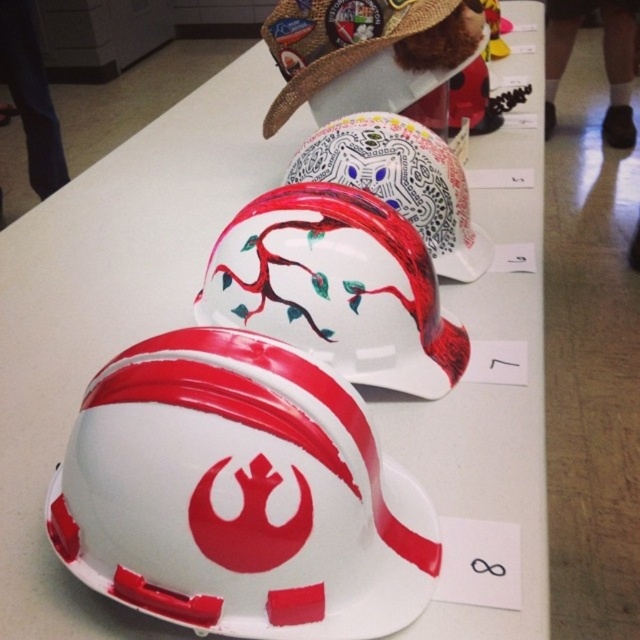
Is white glossy helmet at lower left thinner than white glossy helmet at center?

No.

Which is below, white glossy helmet at lower left or white glossy helmet at center?

white glossy helmet at lower left is lower down.

What are the coordinates of `white glossy helmet at lower left` in the screenshot? It's located at (240, 493).

Where is `white glossy helmet at lower left`? This screenshot has height=640, width=640. white glossy helmet at lower left is located at coordinates (240, 493).

Between brown straw cowboy hat at upper center and white glossy helmet at center, which one has less height?

brown straw cowboy hat at upper center

Who is more forward, (410, 1) or (456, 208)?

Positioned in front is point (456, 208).

Who is more distant from viewer, [275,58] or [436,252]?

The point [275,58] is more distant.

Identify the location of brown straw cowboy hat at upper center. (371, 56).

Can you confirm if white glossy helmet at lower left is positioned below glossy white helmet at center?

Indeed, white glossy helmet at lower left is positioned under glossy white helmet at center.

Who is shorter, white glossy helmet at lower left or glossy white helmet at center?

With less height is white glossy helmet at lower left.

Is point (356, 531) positioned in front of point (372, 214)?

That is True.

The height and width of the screenshot is (640, 640). I want to click on white glossy helmet at lower left, so click(x=240, y=493).